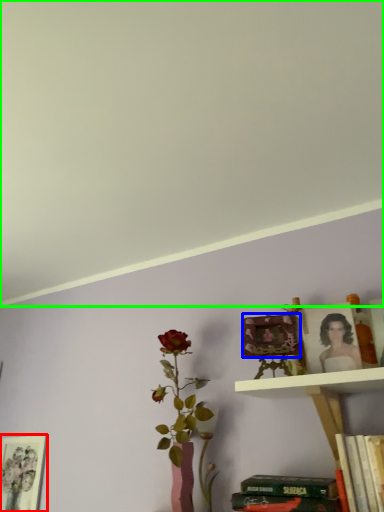
Question: Estimate the real-world distances between objects in this image. Which object is farther from picture frame (highlighted by a red box), picture frame (highlighted by a blue box) or backdrop (highlighted by a green box)?

Choices:
 (A) picture frame
 (B) backdrop

Answer: (B)